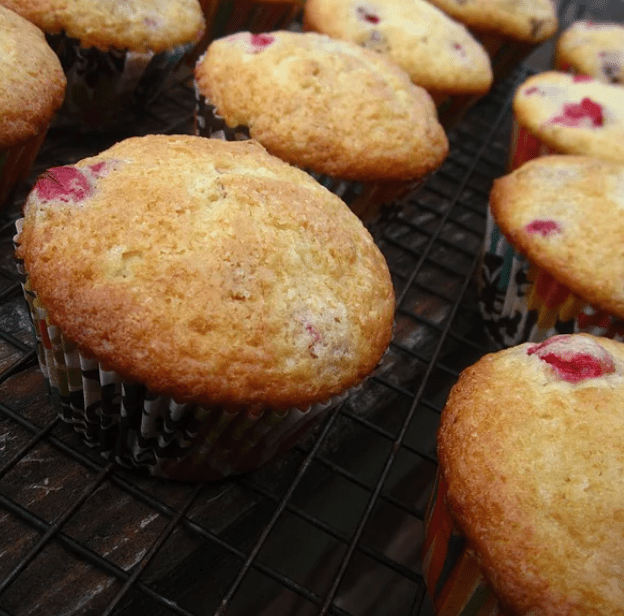
Locate an element on the screen. black wire is located at coordinates (379, 557).